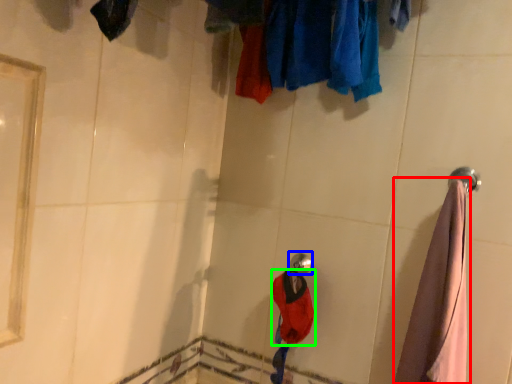
Question: Considering the real-world distances, which object is farthest from garment (highlighted by a red box)? shower (highlighted by a blue box) or clothing (highlighted by a green box)?

Choices:
 (A) shower
 (B) clothing

Answer: (A)